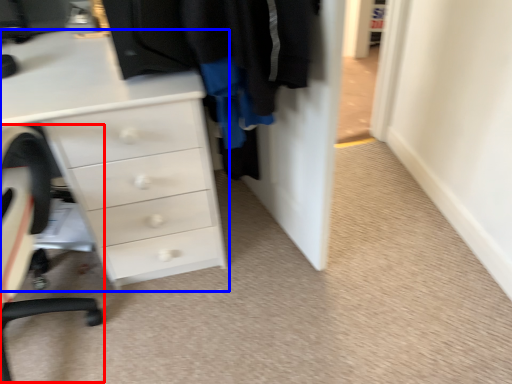
Question: Which object appears farthest to the camera in this image, computer chair (highlighted by a red box) or chest of drawers (highlighted by a blue box)?

Choices:
 (A) computer chair
 (B) chest of drawers

Answer: (B)